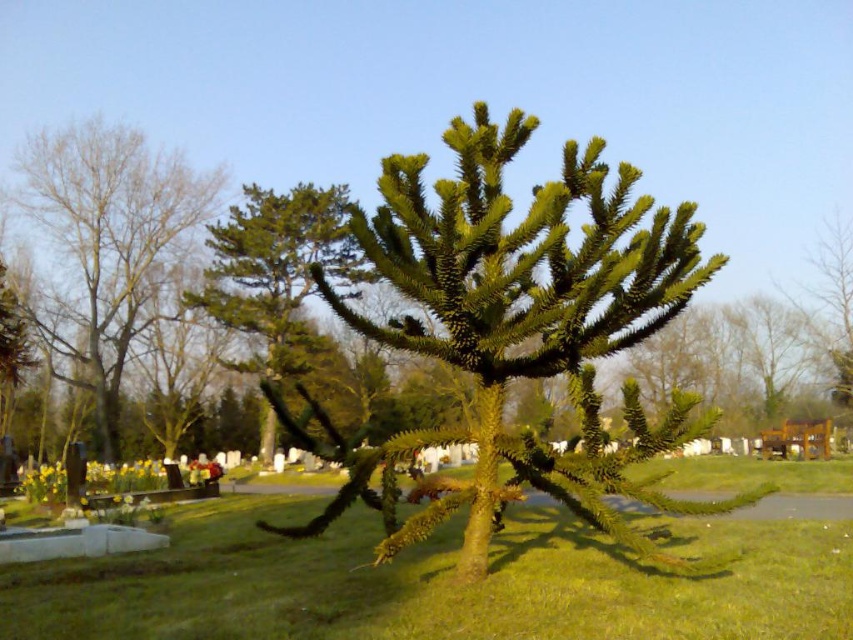
You are standing in a cemetery and see the green spiky tree at left and the green grass at center. Which object is located to the right of the other?

The green grass at center is positioned on the right side of green spiky tree at left.

You are standing at the point marked as point (521, 332) in the cemetery. You want to take a photo of the green spiky tree at center. Which direction should you face to capture it in your camera?

Since the green spiky tree at center is located at point (521, 332), you should face towards that point to take its photo.